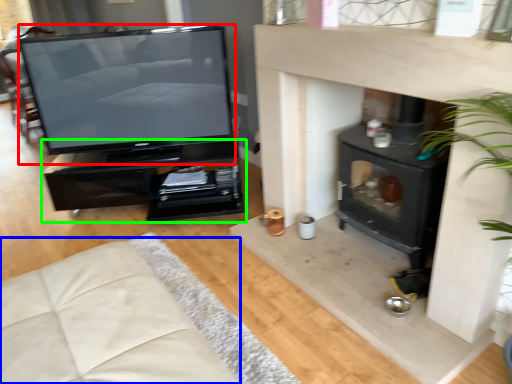
Question: Considering the real-world distances, which object is farthest from television (highlighted by a red box)? couch (highlighted by a blue box) or furniture (highlighted by a green box)?

Choices:
 (A) couch
 (B) furniture

Answer: (A)